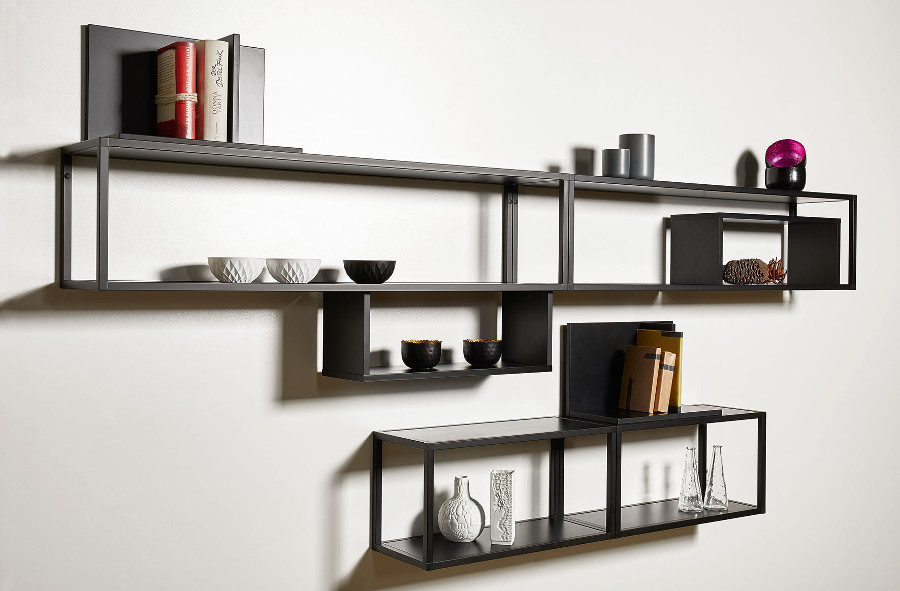
Where is `items on bottom shelve`? The image size is (900, 591). items on bottom shelve is located at coordinates (456, 521), (499, 506), (691, 483), (721, 480), (677, 346), (671, 371), (661, 376), (652, 362), (596, 387).